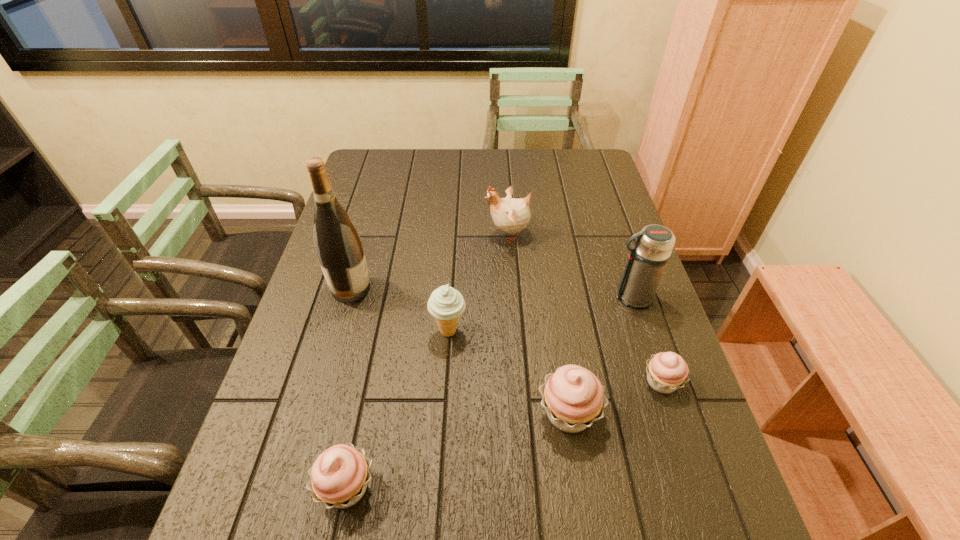
The image size is (960, 540). In the image, there is a desktop. What are the coordinates of `vacant space at the right edge` in the screenshot? It's located at (592, 288).

In the image, there is a desktop. Where is `vacant space at the far right corner`? The height and width of the screenshot is (540, 960). vacant space at the far right corner is located at coordinates (590, 172).

Where is `free space between the sixth shortest object and the fourth nearest object`? The width and height of the screenshot is (960, 540). free space between the sixth shortest object and the fourth nearest object is located at coordinates (540, 314).

Locate an element on the screen. The image size is (960, 540). empty space between the second cupcake from right to left and the third object from left to right is located at coordinates (509, 372).

You are a GUI agent. You are given a task and a screenshot of the screen. Output one action in this format:
    pyautogui.click(x=<x>, y=<y>)
    Task: Click on the vacant area that lies between the wine bottle and the thermos bottle
    This screenshot has height=540, width=960.
    Given the screenshot: What is the action you would take?
    pyautogui.click(x=492, y=293)

You are a GUI agent. You are given a task and a screenshot of the screen. Output one action in this format:
    pyautogui.click(x=<x>, y=<y>)
    Task: Click on the free area in between the second cupcake from right to left and the wine bottle
    This screenshot has height=540, width=960.
    Given the screenshot: What is the action you would take?
    pyautogui.click(x=460, y=351)

At what (x,y) coordinates should I click in order to perform the action: click on vacant space that is in between the tallest cupcake and the thermos bottle. Please return your answer as a coordinate pair (x, y). This screenshot has width=960, height=540. Looking at the image, I should click on (600, 355).

At what (x,y) coordinates should I click in order to perform the action: click on vacant space in between the wine bottle and the second cupcake from right to left. Please return your answer as a coordinate pair (x, y). This screenshot has height=540, width=960. Looking at the image, I should click on (460, 351).

The image size is (960, 540). What are the coordinates of `free space between the fourth nearest object and the second cupcake from right to left` in the screenshot? It's located at (509, 372).

At what (x,y) coordinates should I click in order to perform the action: click on vacant point located between the tallest object and the bird. Please return your answer as a coordinate pair (x, y). The width and height of the screenshot is (960, 540). Looking at the image, I should click on (430, 261).